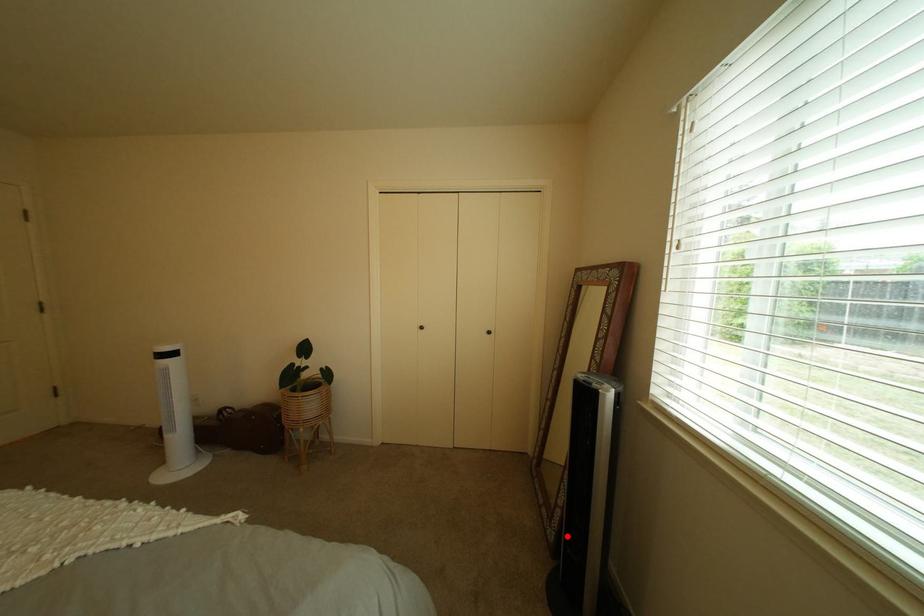
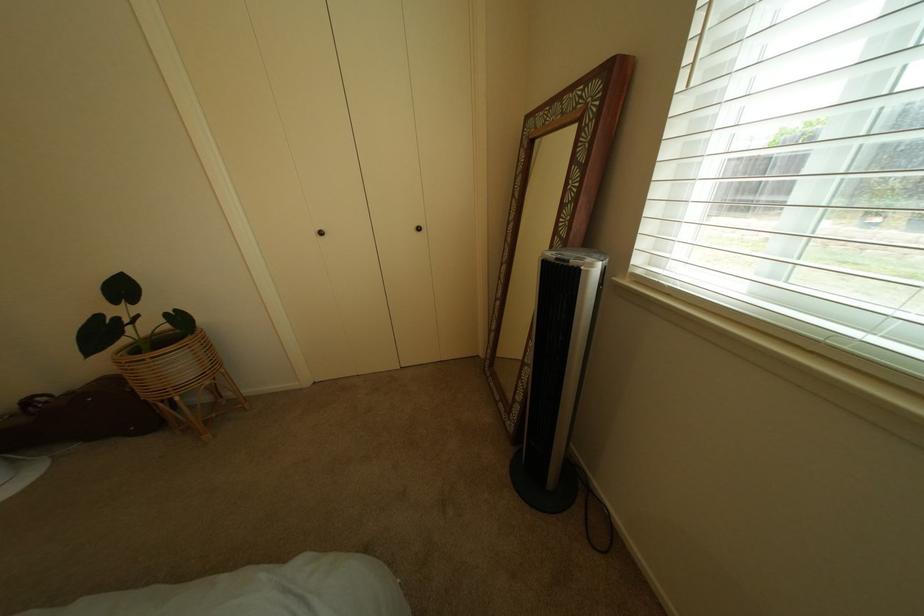
Locate, in the second image, the point that corresponds to the highlighted location in the first image.

(527, 428)